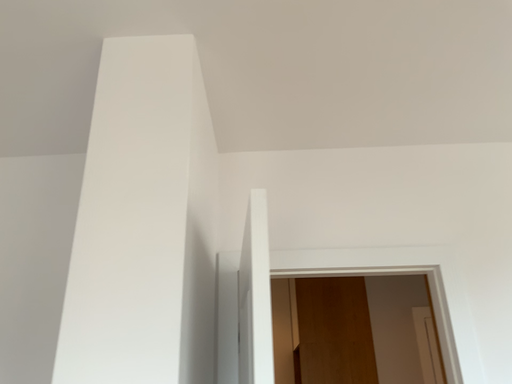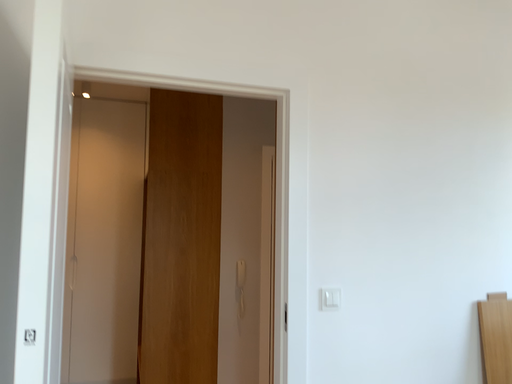
Question: How did the camera likely rotate when shooting the video?

Choices:
 (A) rotated downward
 (B) rotated upward

Answer: (A)